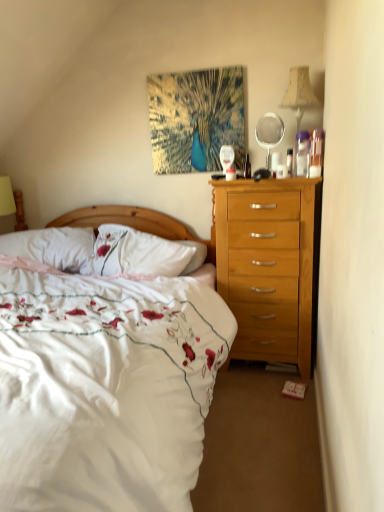
The height and width of the screenshot is (512, 384). What are the coordinates of `white soft pillow at left` in the screenshot? It's located at (53, 247).

Where is `matte white coffee cup at upper right`? The height and width of the screenshot is (512, 384). matte white coffee cup at upper right is located at coordinates (276, 165).

Where is `clear plastic mirror at upper right`? The height and width of the screenshot is (512, 384). clear plastic mirror at upper right is located at coordinates (269, 133).

From a real-world perspective, is matte white coffee cup at upper right positioned under white floral fabric bed at center based on gravity?

Actually, matte white coffee cup at upper right is physically above white floral fabric bed at center in the real world.

Who is smaller, matte white coffee cup at upper right or white floral fabric bed at center?

matte white coffee cup at upper right.

Is matte white coffee cup at upper right located outside white floral fabric bed at center?

That's correct, matte white coffee cup at upper right is outside of white floral fabric bed at center.

From the image's perspective, is matte white coffee cup at upper right located above white floral fabric bed at center?

Indeed, from the image's perspective, matte white coffee cup at upper right is shown above white floral fabric bed at center.

How many degrees apart are the facing directions of white soft pillow at left and matte white coffee cup at upper right?

The angle between the facing direction of white soft pillow at left and the facing direction of matte white coffee cup at upper right is 12.8 degrees.

Could you tell me if white soft pillow at left is turned towards matte white coffee cup at upper right?

No, white soft pillow at left is not turned towards matte white coffee cup at upper right.

From a real-world perspective, which is physically above, white soft pillow at left or matte white coffee cup at upper right?

matte white coffee cup at upper right is physically above.

Which object is closer to the camera, white soft pillow at left or matte white coffee cup at upper right?

matte white coffee cup at upper right.

Is beige fabric lampshade at upper right thinner than white floral fabric bed at center?

Yes, beige fabric lampshade at upper right is thinner than white floral fabric bed at center.

Is beige fabric lampshade at upper right turned away from white floral fabric bed at center?

No, beige fabric lampshade at upper right's orientation is not away from white floral fabric bed at center.

Between beige fabric lampshade at upper right and white floral fabric bed at center, which one has larger size?

white floral fabric bed at center.

From a real-world perspective, is beige fabric lampshade at upper right positioned above or below white floral fabric bed at center?

In terms of real-world spatial position, beige fabric lampshade at upper right is above white floral fabric bed at center.

From the image's perspective, is white floral fabric bed at center under matte white coffee cup at upper right?

Yes, from the image's perspective, white floral fabric bed at center is beneath matte white coffee cup at upper right.

Is white floral fabric bed at center in contact with matte white coffee cup at upper right?

No, white floral fabric bed at center is not beside matte white coffee cup at upper right.

Does white floral fabric bed at center turn towards matte white coffee cup at upper right?

No, white floral fabric bed at center is not aimed at matte white coffee cup at upper right.

At what (x,y) coordinates should I click in order to perform the action: click on mirror above the white soft pillow at left (from a real-world perspective). Please return your answer as a coordinate pair (x, y). This screenshot has width=384, height=512. Looking at the image, I should click on (269, 133).

From their relative heights in the image, would you say clear plastic mirror at upper right is taller or shorter than white soft pillow at left?

Considering their sizes, clear plastic mirror at upper right has more height than white soft pillow at left.

Considering the positions of point (277, 123) and point (26, 257), is point (277, 123) closer or farther from the camera than point (26, 257)?

Clearly, point (277, 123) is more distant from the camera than point (26, 257).

Who is more distant, clear plastic mirror at upper right or white soft pillow at left?

white soft pillow at left.

Considering the relative positions of matte white coffee cup at upper right and white soft pillow at left in the image provided, is matte white coffee cup at upper right to the left or to the right of white soft pillow at left?

From the image, it's evident that matte white coffee cup at upper right is to the right of white soft pillow at left.

From a real-world perspective, does matte white coffee cup at upper right stand above white soft pillow at left?

Yes, from a real-world perspective, matte white coffee cup at upper right is on top of white soft pillow at left.

From the image's perspective, is matte white coffee cup at upper right on white soft pillow at left?

Indeed, from the image's perspective, matte white coffee cup at upper right is shown above white soft pillow at left.

Is matte white coffee cup at upper right facing away from white soft pillow at left?

No, matte white coffee cup at upper right is not facing away from white soft pillow at left.

Between white floral fabric bed at center and white soft pillow at left, which one has more height?

white floral fabric bed at center is taller.

Are white floral fabric bed at center and white soft pillow at left beside each other?

white floral fabric bed at center is not next to white soft pillow at left, and they're not touching.

From the picture: Do you think white floral fabric bed at center is within white soft pillow at left, or outside of it?

white floral fabric bed at center lies outside white soft pillow at left.

I want to click on bed in front of the white soft pillow at left, so click(x=105, y=388).

This screenshot has height=512, width=384. In order to click on bed in front of the matte white coffee cup at upper right in this screenshot , I will do `click(105, 388)`.

Where is `pillow that is behind the matte white coffee cup at upper right`? The image size is (384, 512). pillow that is behind the matte white coffee cup at upper right is located at coordinates (53, 247).

Which object lies nearer to the anchor point white soft pillow at left, matte white coffee cup at upper right or clear plastic mirror at upper right?

clear plastic mirror at upper right lies closer to white soft pillow at left than the other object.

Estimate the real-world distances between objects in this image. Which object is further from matte white coffee cup at upper right, beige fabric lampshade at upper right or white floral fabric bed at center?

Among the two, white floral fabric bed at center is located further to matte white coffee cup at upper right.

From the image, which object appears to be nearer to matte white coffee cup at upper right, beige fabric lampshade at upper right or clear plastic mirror at upper right?

clear plastic mirror at upper right lies closer to matte white coffee cup at upper right than the other object.

From the image, which object appears to be nearer to beige fabric lampshade at upper right, clear plastic mirror at upper right or matte white coffee cup at upper right?

clear plastic mirror at upper right.

Based on their spatial positions, is white soft pillow at left or clear plastic mirror at upper right further from beige fabric lampshade at upper right?

Based on the image, white soft pillow at left appears to be further to beige fabric lampshade at upper right.

Estimate the real-world distances between objects in this image. Which object is further from white floral fabric bed at center, white soft pillow at left or matte white coffee cup at upper right?

Among the two, matte white coffee cup at upper right is located further to white floral fabric bed at center.

When comparing their distances from clear plastic mirror at upper right, does white soft pillow at left or white floral fabric bed at center seem closer?

Among the two, white soft pillow at left is located nearer to clear plastic mirror at upper right.

Estimate the real-world distances between objects in this image. Which object is further from white soft pillow at left, beige fabric lampshade at upper right or white floral fabric bed at center?

The object further to white soft pillow at left is beige fabric lampshade at upper right.

In order to click on coffee cup situated between white soft pillow at left and beige fabric lampshade at upper right from left to right in this screenshot , I will do `click(276, 165)`.

Identify the location of mirror located between white floral fabric bed at center and white soft pillow at left in the depth direction. This screenshot has width=384, height=512. (269, 133).

At what (x,y) coordinates should I click in order to perform the action: click on bedside lamp between white floral fabric bed at center and clear plastic mirror at upper right in the front-back direction. Please return your answer as a coordinate pair (x, y). The height and width of the screenshot is (512, 384). Looking at the image, I should click on (299, 93).

Where is `bedside lamp located between white floral fabric bed at center and white soft pillow at left in the depth direction`? Image resolution: width=384 pixels, height=512 pixels. bedside lamp located between white floral fabric bed at center and white soft pillow at left in the depth direction is located at coordinates tap(299, 93).